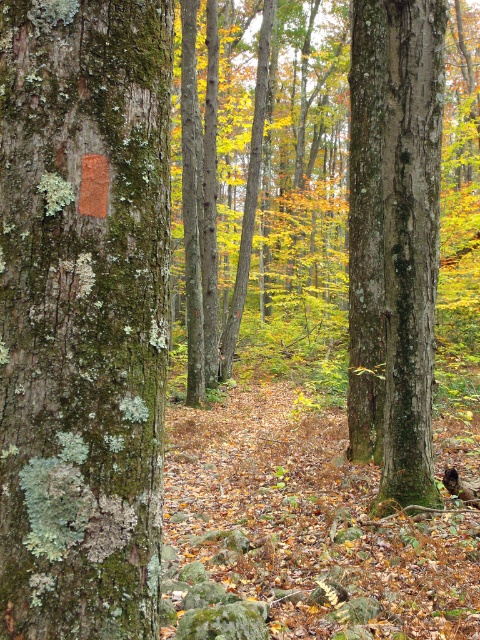
Is green mossy bark at left positioned behind green rough bark tree trunk at center?

No, it is in front of green rough bark tree trunk at center.

Between point (95, 138) and point (375, 22), which one is positioned in front?

Point (95, 138) is in front.

Identify the location of green mossy bark at left. [x=83, y=314].

Identify the location of green mossy bark at left. (83, 314).